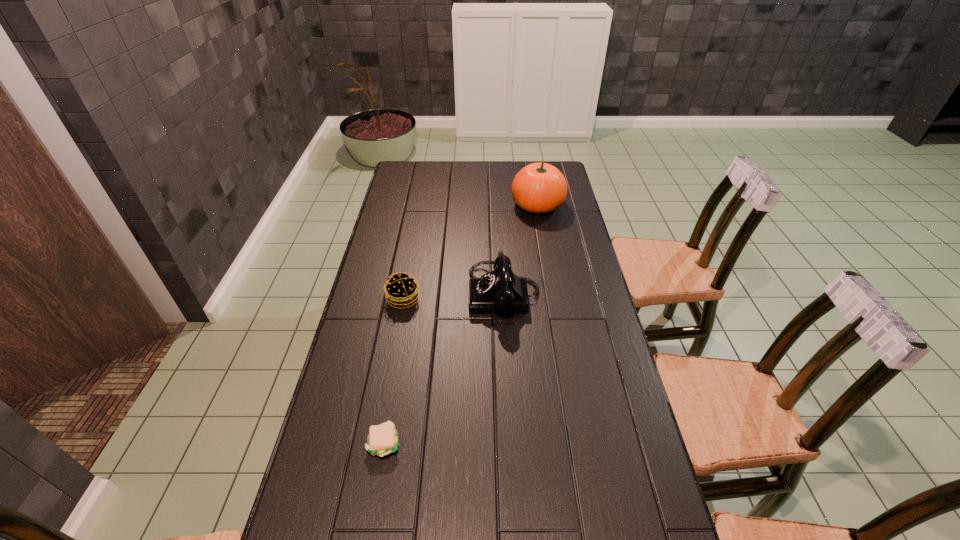
Find the location of a particular element. Image resolution: width=960 pixels, height=540 pixels. pumpkin is located at coordinates (538, 188).

The width and height of the screenshot is (960, 540). I want to click on the tallest object, so click(538, 188).

Where is `the second tallest object`? The height and width of the screenshot is (540, 960). the second tallest object is located at coordinates (501, 291).

I want to click on the farther patty, so click(401, 288).

In order to click on the second shortest object in this screenshot , I will do (401, 288).

Where is `the nearest object`? The width and height of the screenshot is (960, 540). the nearest object is located at coordinates (383, 439).

At what (x,y) coordinates should I click in order to perform the action: click on the shortest object. Please return your answer as a coordinate pair (x, y). Image resolution: width=960 pixels, height=540 pixels. Looking at the image, I should click on (383, 439).

Locate an element on the screen. The width and height of the screenshot is (960, 540). vacant space located 0.220m on the back of the farthest object is located at coordinates (531, 166).

Find the location of a particular element. The image size is (960, 540). vacant area located 0.180m on the dial of the telephone is located at coordinates (414, 293).

In order to click on free space located on the dial of the telephone in this screenshot , I will do `click(405, 293)`.